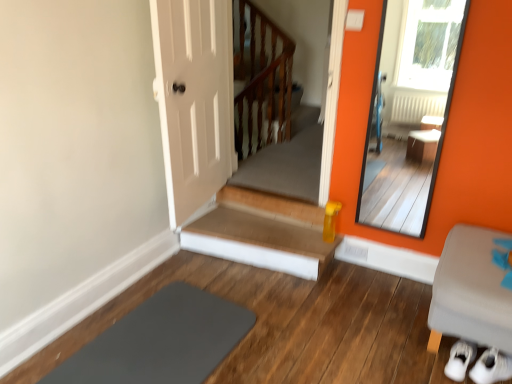
At what (x,y) coordinates should I click in order to perform the action: click on empty space that is in between gray fabric ottoman at lower right and wooden stairs at center. Please return your answer as a coordinate pair (x, y). Looking at the image, I should click on click(x=352, y=306).